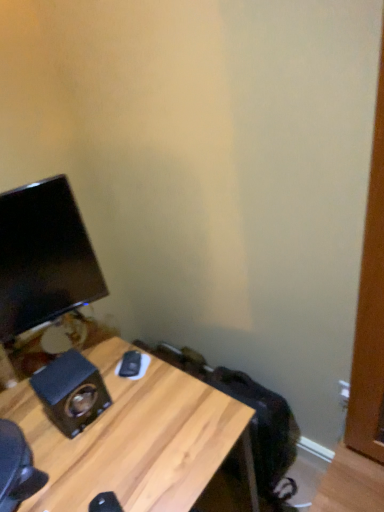
You are a GUI agent. You are given a task and a screenshot of the screen. Output one action in this format:
    pyautogui.click(x=<x>, y=<y>)
    Task: Click on the unoccupied space behind wooden grain speaker at lower left
    The image size is (384, 512).
    Given the screenshot: What is the action you would take?
    pyautogui.click(x=91, y=350)